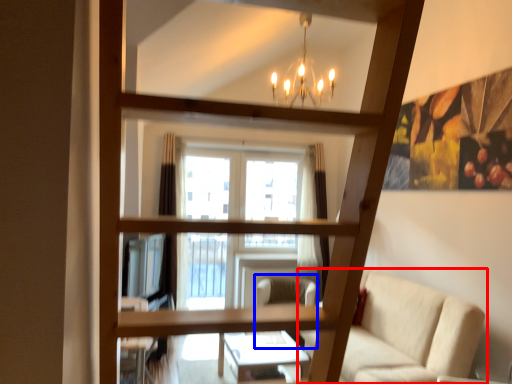
Question: Which of the following is the closest to the observer, studio couch (highlighted by a red box) or swivel chair (highlighted by a blue box)?

Choices:
 (A) studio couch
 (B) swivel chair

Answer: (A)